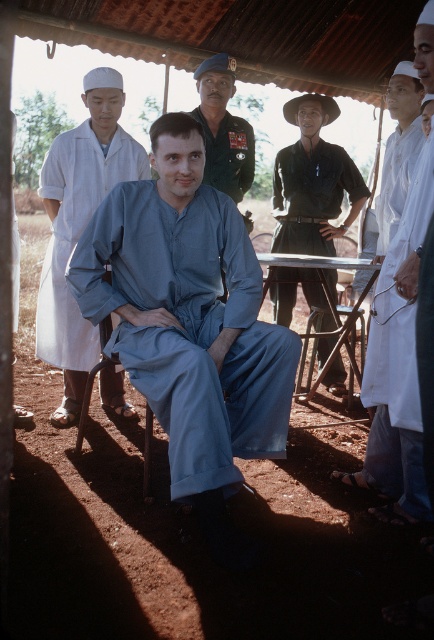
Which is behind, point (111, 211) or point (408, 477)?

Positioned behind is point (111, 211).

Can you confirm if matte blue jumpsuit at center is positioned above white cloth coat at right?

Correct, matte blue jumpsuit at center is located above white cloth coat at right.

Does point (220, 384) come behind point (385, 332)?

No, (220, 384) is closer to viewer.

Find the location of `matte blue jumpsuit at center`. matte blue jumpsuit at center is located at coordinates (190, 320).

Can you confirm if matte blue jumpsuit at center is positioned to the left of metallic silver picnic table at center?

Indeed, matte blue jumpsuit at center is positioned on the left side of metallic silver picnic table at center.

Which of these two, matte blue jumpsuit at center or metallic silver picnic table at center, stands taller?

With more height is matte blue jumpsuit at center.

The width and height of the screenshot is (434, 640). Describe the element at coordinates (190, 320) in the screenshot. I see `matte blue jumpsuit at center` at that location.

Find the location of a particular element. The width and height of the screenshot is (434, 640). matte blue jumpsuit at center is located at coordinates (190, 320).

In the scene shown: Which is below, dark green uniform at center or metallic silver picnic table at center?

metallic silver picnic table at center is lower down.

Consider the image. Who is more distant from viewer, (x=335, y=385) or (x=295, y=266)?

The point (x=335, y=385) is more distant.

Who is more forward, (278,305) or (289,257)?

Positioned in front is point (289,257).

Identify the location of dark green uniform at center. The width and height of the screenshot is (434, 640). (312, 180).